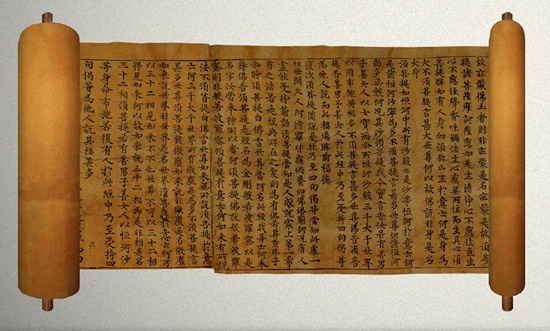
Locate an element on the screen. bar is located at coordinates (49, 304).